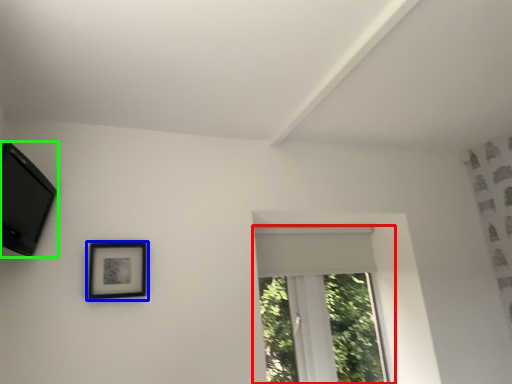
Question: Which is farther away from window (highlighted by a red box)? picture frame (highlighted by a blue box) or picture frame (highlighted by a green box)?

Choices:
 (A) picture frame
 (B) picture frame

Answer: (B)